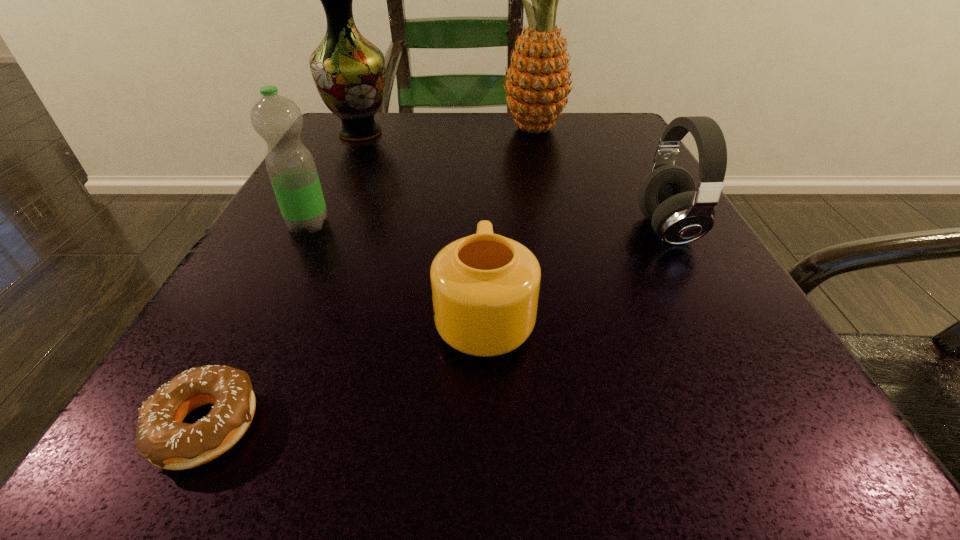
I want to click on vacant region located 0.400m on the front of the vase, so click(x=287, y=280).

The width and height of the screenshot is (960, 540). I want to click on vacant point located 0.120m on the front of the fourth shortest object, so click(274, 292).

The image size is (960, 540). I want to click on vacant space located on the ear cups of the fourth tallest object, so click(404, 230).

You are a GUI agent. You are given a task and a screenshot of the screen. Output one action in this format:
    pyautogui.click(x=<x>, y=<y>)
    Task: Click on the blank space located on the ear cups of the fourth tallest object
    The height and width of the screenshot is (540, 960).
    Given the screenshot: What is the action you would take?
    pyautogui.click(x=597, y=230)

The image size is (960, 540). In order to click on vacant space located on the ear cups of the fourth tallest object in this screenshot , I will do `click(385, 230)`.

Where is `vacant space situated on the handle side of the second shortest object`? This screenshot has height=540, width=960. vacant space situated on the handle side of the second shortest object is located at coordinates (483, 168).

Locate an element on the screen. Image resolution: width=960 pixels, height=540 pixels. vacant space located 0.180m on the handle side of the second shortest object is located at coordinates (484, 202).

Find the location of `blank space located 0.270m on the handle side of the second shortest object`. blank space located 0.270m on the handle side of the second shortest object is located at coordinates (483, 176).

Find the location of a particular element. This screenshot has width=960, height=540. vacant space located 0.230m on the back of the doughnut is located at coordinates (298, 248).

Find the location of a particular element. The height and width of the screenshot is (540, 960). pineapple present at the far edge is located at coordinates (537, 86).